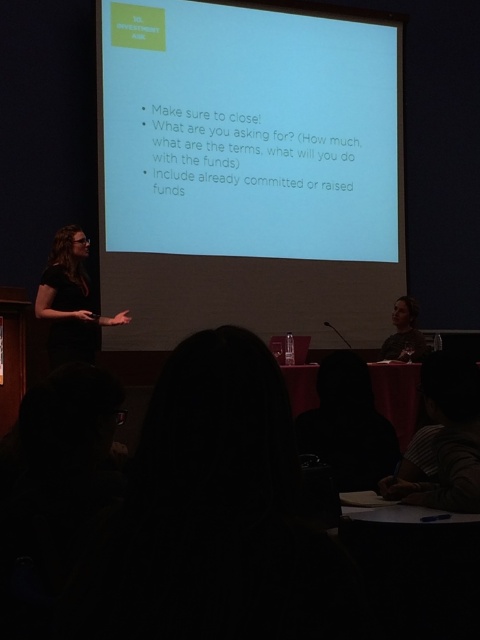
You are an attendee at the presentation and you want to see both the black matte shirt at left and the white matte projection screen at center clearly. Which object is closer to you?

The white matte projection screen at center is closer to you because the black matte shirt at left is behind it, meaning the screen is in front and nearer to your position as an attendee.

You are an event planner setting up a presentation room. You need to ensure that the white matte projection screen at center and the black matte shirt at left are visible to the audience. Given that the screen and shirt have different heights, which object will appear taller to the audience?

The white matte projection screen at center is taller than the black matte shirt at left, so it will appear taller to the audience.

You are an attendee at the presentation. You want to take a photo of the slide on the white matte projection screen at center but need to ensure the black matte shirt at left isn

The white matte projection screen at center is to the right of the black matte shirt at left, so if you position yourself to the right of the black matte shirt at left, you can capture the slide without the shirt blocking your view.